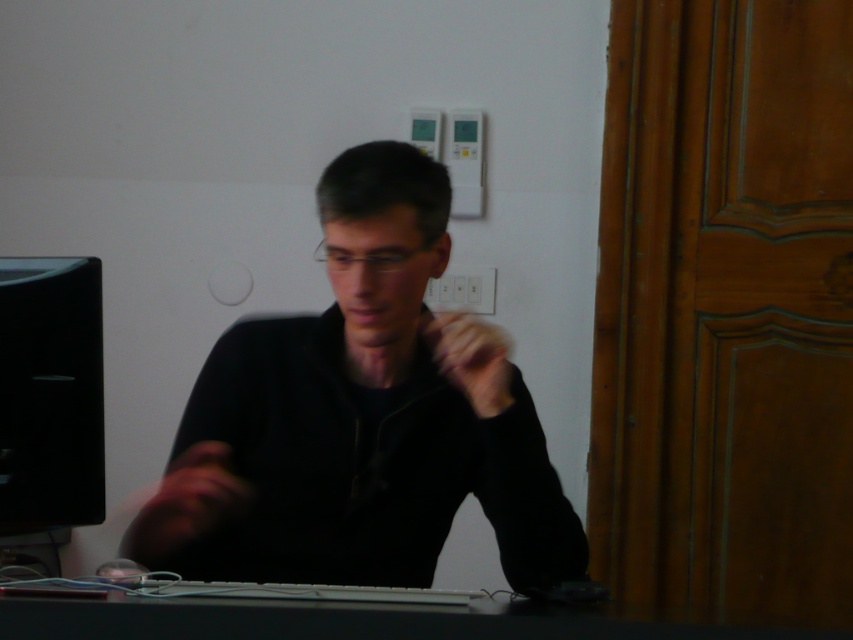
Question: Which object appears closest to the camera in this image?

Choices:
 (A) black matte shirt at center
 (B) black glossy monitor at left
 (C) black plastic keyboard at lower center

Answer: (C)

Question: Which object is positioned closest to the black glossy monitor at left?

Choices:
 (A) black plastic keyboard at lower center
 (B) black matte shirt at center

Answer: (B)

Question: Is black matte shirt at center in front of black plastic keyboard at lower center?

Choices:
 (A) no
 (B) yes

Answer: (A)

Question: Observing the image, what is the correct spatial positioning of black matte shirt at center in reference to black glossy monitor at left?

Choices:
 (A) below
 (B) above

Answer: (B)

Question: Is black glossy monitor at left above black plastic keyboard at lower center?

Choices:
 (A) yes
 (B) no

Answer: (A)

Question: Estimate the real-world distances between objects in this image. Which object is farther from the black glossy monitor at left?

Choices:
 (A) black plastic keyboard at lower center
 (B) black matte shirt at center

Answer: (A)